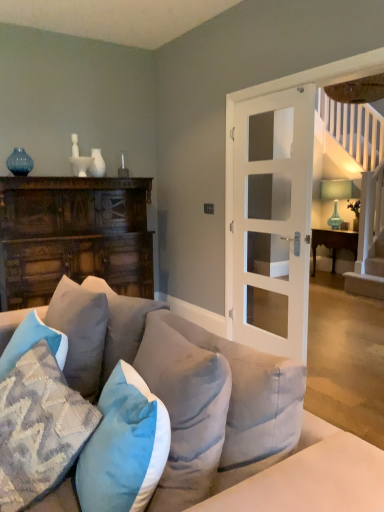
Locate an element on the screen. The image size is (384, 512). dark wood cabinet at left is located at coordinates (73, 236).

Identify the location of blue velvet pillow at center, the first pillow when ordered from right to left. (185, 409).

Identify the location of velvet blue couch at center. This screenshot has width=384, height=512. (319, 466).

The width and height of the screenshot is (384, 512). In order to click on wooden table at right in this screenshot , I will do `click(333, 243)`.

What do you see at coordinates (39, 428) in the screenshot? I see `textured woolen pillow at lower left, which is counted as the fourth pillow, starting from the right` at bounding box center [39, 428].

This screenshot has width=384, height=512. Identify the location of white glass door at center. (273, 215).

Measure the distance between teal glass vase at upper left and blue velvet pillow at center, the 5th pillow when ordered from left to right.

2.78 meters.

Between teal glass vase at upper left and blue velvet pillow at center, the first pillow when ordered from right to left, which one has less height?

Standing shorter between the two is teal glass vase at upper left.

Is teal glass vase at upper left positioned beyond the bounds of blue velvet pillow at center, the first pillow when ordered from right to left?

That's correct, teal glass vase at upper left is outside of blue velvet pillow at center, the first pillow when ordered from right to left.

Considering the relative sizes of teal glass vase at upper left and blue velvet pillow at center, the first pillow when ordered from right to left, in the image provided, is teal glass vase at upper left smaller than blue velvet pillow at center, the first pillow when ordered from right to left,?

Correct, teal glass vase at upper left occupies less space than blue velvet pillow at center, the first pillow when ordered from right to left.

Consider the image. Is dark wood cabinet at left taller than textured gray pillow at left, which appears as the third pillow when viewed from the right?

Indeed, dark wood cabinet at left has a greater height compared to textured gray pillow at left, which appears as the third pillow when viewed from the right.

From the image's perspective, which one is positioned higher, dark wood cabinet at left or textured gray pillow at left, which appears as the third pillow when viewed from the left?

From the image's view, dark wood cabinet at left is above.

Is textured gray pillow at left, which appears as the third pillow when viewed from the left, at the back of dark wood cabinet at left?

No, textured gray pillow at left, which appears as the third pillow when viewed from the left, is not at the back of dark wood cabinet at left.

Where is `studio couch located on the right of textured gray pillow at left, which appears as the third pillow when viewed from the right`? This screenshot has width=384, height=512. studio couch located on the right of textured gray pillow at left, which appears as the third pillow when viewed from the right is located at coordinates (319, 466).

Would you say velvet blue couch at center contains textured gray pillow at left, which appears as the third pillow when viewed from the right?

Yes, velvet blue couch at center is surrounding textured gray pillow at left, which appears as the third pillow when viewed from the right.

What's the angular difference between velvet blue couch at center and textured gray pillow at left, which appears as the third pillow when viewed from the right,'s facing directions?

The facing directions of velvet blue couch at center and textured gray pillow at left, which appears as the third pillow when viewed from the right, are 86.8 degrees apart.

Is textured gray pillow at left, which appears as the third pillow when viewed from the left, oriented towards velvet blue couch at center?

Yes, textured gray pillow at left, which appears as the third pillow when viewed from the left, is aimed at velvet blue couch at center.

Considering the sizes of objects textured gray pillow at left, which appears as the third pillow when viewed from the right, and velvet blue couch at center in the image provided, who is thinner, textured gray pillow at left, which appears as the third pillow when viewed from the right, or velvet blue couch at center?

textured gray pillow at left, which appears as the third pillow when viewed from the right, is thinner.

Is textured gray pillow at left, which appears as the third pillow when viewed from the right, directly adjacent to velvet blue couch at center?

textured gray pillow at left, which appears as the third pillow when viewed from the right, and velvet blue couch at center are clearly separated.

From a real-world perspective, is textured gray pillow at left, which appears as the third pillow when viewed from the right, physically located above or below velvet blue couch at center?

Clearly, from a real-world perspective, textured gray pillow at left, which appears as the third pillow when viewed from the right, is above velvet blue couch at center.

Is the depth of wooden table at right greater than that of velvet blue couch at center?

Yes, it is behind velvet blue couch at center.

Which object is wider, wooden table at right or velvet blue couch at center?

velvet blue couch at center is wider.

Based on the photo, which of these two, wooden table at right or velvet blue couch at center, stands shorter?

With less height is wooden table at right.

From a real-world perspective, is textured woolen pillow at lower left, which is counted as the fourth pillow, starting from the right, physically located above or below wooden table at right?

textured woolen pillow at lower left, which is counted as the fourth pillow, starting from the right, is above wooden table at right.

Could you tell me if textured woolen pillow at lower left, which is counted as the fourth pillow, starting from the right, is turned towards wooden table at right?

No, textured woolen pillow at lower left, which is counted as the fourth pillow, starting from the right, is not turned towards wooden table at right.

Can you confirm if textured woolen pillow at lower left, which is the second pillow in left-to-right order, is bigger than wooden table at right?

No.

Considering the relative sizes of dark wood cabinet at left and textured woolen pillow at lower left, which is the second pillow in left-to-right order, in the image provided, is dark wood cabinet at left thinner than textured woolen pillow at lower left, which is the second pillow in left-to-right order,?

No.

From the image's perspective, between dark wood cabinet at left and textured woolen pillow at lower left, which is counted as the fourth pillow, starting from the right, who is located below?

textured woolen pillow at lower left, which is counted as the fourth pillow, starting from the right.

I want to click on cabinetry behind the textured woolen pillow at lower left, which is counted as the fourth pillow, starting from the right, so click(x=73, y=236).

Is point (135, 226) positioned after point (10, 390)?

Yes, it is.

You are a GUI agent. You are given a task and a screenshot of the screen. Output one action in this format:
    pyautogui.click(x=<x>, y=<y>)
    Task: Click on the 3rd pillow below the teal glass vase at upper left (from the image's perspective)
    The width and height of the screenshot is (384, 512).
    Given the screenshot: What is the action you would take?
    pyautogui.click(x=185, y=409)

This screenshot has height=512, width=384. Find the location of `cabinetry on the left of textured gray pillow at left, which appears as the third pillow when viewed from the left`. cabinetry on the left of textured gray pillow at left, which appears as the third pillow when viewed from the left is located at coordinates (73, 236).

Based on their spatial positions, is textured blue pillow at lower left, which appears as the fifth pillow when viewed from the right, or dark wood cabinet at left closer to textured gray pillow at left, which appears as the third pillow when viewed from the left?

textured blue pillow at lower left, which appears as the fifth pillow when viewed from the right.

Looking at the image, which one is located closer to velvet blue couch at center, white glass door at center or blue velvet pillow at center, the 5th pillow when ordered from left to right?

white glass door at center lies closer to velvet blue couch at center than the other object.

From the image, which object appears to be nearer to textured gray pillow at left, which appears as the third pillow when viewed from the left, textured woolen pillow at lower left, which is the second pillow in left-to-right order, or wooden table at right?

textured woolen pillow at lower left, which is the second pillow in left-to-right order, is closer to textured gray pillow at left, which appears as the third pillow when viewed from the left.

Considering their positions, is blue velvet pillow at center, the 5th pillow when ordered from left to right, positioned further to textured gray pillow at left, which appears as the third pillow when viewed from the left, than velvet blue couch at center?

The object further to textured gray pillow at left, which appears as the third pillow when viewed from the left, is velvet blue couch at center.

Looking at the image, which one is located further to white glass door at center, wooden table at right or velvety blue pillow at lower left, which is counted as the fourth pillow, starting from the left?

wooden table at right.

Considering their positions, is white glass door at center positioned closer to teal glass vase at upper left than velvety blue pillow at lower left, which is counted as the fourth pillow, starting from the left?

white glass door at center lies closer to teal glass vase at upper left than the other object.

From the image, which object appears to be farther from textured blue pillow at lower left, which appears as the fifth pillow when viewed from the right, teal glass vase at upper left or textured woolen pillow at lower left, which is counted as the fourth pillow, starting from the right?

Based on the image, teal glass vase at upper left appears to be further to textured blue pillow at lower left, which appears as the fifth pillow when viewed from the right.

Based on their spatial positions, is velvety blue pillow at lower left, which is counted as the fourth pillow, starting from the left, or textured woolen pillow at lower left, which is counted as the fourth pillow, starting from the right, further from velvet blue couch at center?

textured woolen pillow at lower left, which is counted as the fourth pillow, starting from the right.

Where is `door between velvety blue pillow at lower left, which is counted as the fourth pillow, starting from the left, and green glass vase at right in the front-back direction`? door between velvety blue pillow at lower left, which is counted as the fourth pillow, starting from the left, and green glass vase at right in the front-back direction is located at coordinates (273, 215).

At what (x,y) coordinates should I click in order to perform the action: click on door between textured woolen pillow at lower left, which is the second pillow in left-to-right order, and green glass vase at right, along the z-axis. Please return your answer as a coordinate pair (x, y). This screenshot has height=512, width=384. Looking at the image, I should click on (273, 215).

Find the location of `cabinetry located between blue velvet pillow at center, the 5th pillow when ordered from left to right, and wooden table at right in the depth direction`. cabinetry located between blue velvet pillow at center, the 5th pillow when ordered from left to right, and wooden table at right in the depth direction is located at coordinates (73, 236).

The width and height of the screenshot is (384, 512). Find the location of `teal positioned between textured woolen pillow at lower left, which is counted as the fourth pillow, starting from the right, and wooden table at right from near to far`. teal positioned between textured woolen pillow at lower left, which is counted as the fourth pillow, starting from the right, and wooden table at right from near to far is located at coordinates (19, 162).